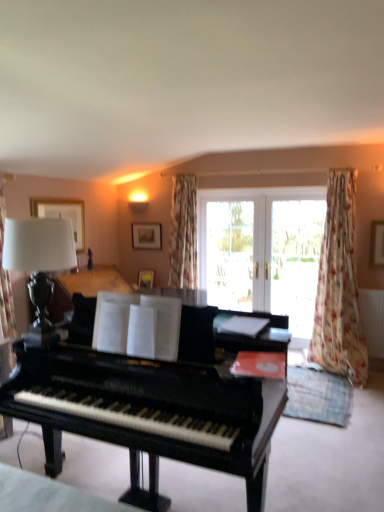
Question: In the image, is floral fabric curtain at right positioned in front of or behind transparent glass screen door at center, the 2th screen door positioned from the left?

Choices:
 (A) behind
 (B) front

Answer: (B)

Question: Considering the positions of floral fabric curtain at right and transparent glass screen door at center, which is counted as the first screen door, starting from the right, in the image, is floral fabric curtain at right wider or thinner than transparent glass screen door at center, which is counted as the first screen door, starting from the right,?

Choices:
 (A) wide
 (B) thin

Answer: (A)

Question: Which is farther from the white glass doors at center?

Choices:
 (A) floral fabric curtain at right
 (B) matte black lamp at left
 (C) transparent glass screen door at center, the second screen door from the right
 (D) transparent glass screen door at center, which is counted as the first screen door, starting from the right
 (E) shiny black piano at center

Answer: (B)

Question: Considering the real-world distances, which object is closest to the transparent glass screen door at center, the 2th screen door positioned from the left?

Choices:
 (A) shiny black piano at center
 (B) transparent glass screen door at center, the second screen door from the right
 (C) matte black lamp at left
 (D) floral fabric curtain at right
 (E) white glass doors at center

Answer: (E)